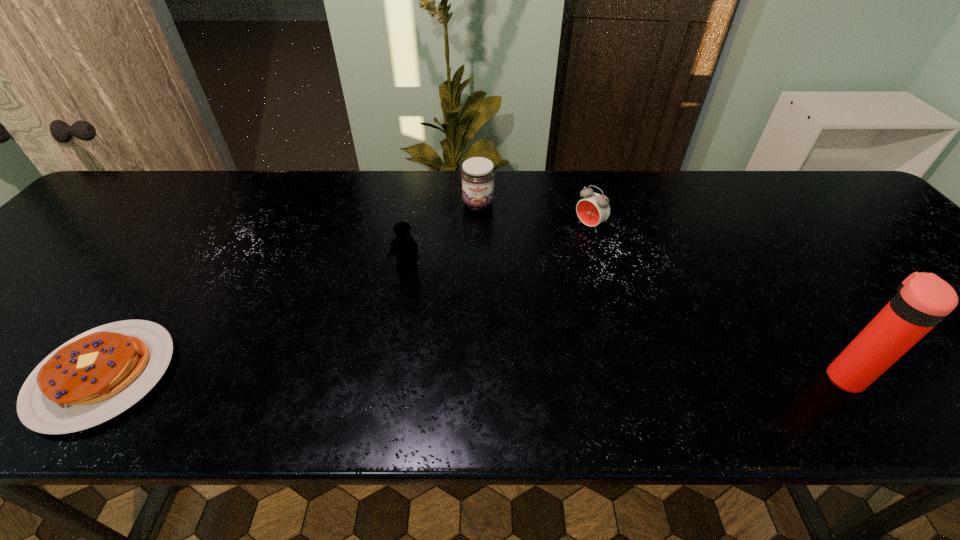
Find the location of a particular element. This screenshot has height=540, width=960. the tallest object is located at coordinates (923, 300).

The width and height of the screenshot is (960, 540). I want to click on thermos bottle, so click(923, 300).

Where is `the third farthest object`? the third farthest object is located at coordinates (405, 248).

This screenshot has width=960, height=540. What are the coordinates of `Lego` in the screenshot? It's located at (405, 248).

Where is `the farthest object`? The image size is (960, 540). the farthest object is located at coordinates (477, 175).

The image size is (960, 540). Identify the location of jam. click(477, 175).

This screenshot has height=540, width=960. I want to click on alarm clock, so click(593, 209).

The width and height of the screenshot is (960, 540). In order to click on the fourth nearest object in this screenshot , I will do `click(593, 209)`.

Locate an element on the screen. The height and width of the screenshot is (540, 960). vacant area situated 0.090m on the left of the thermos bottle is located at coordinates (780, 376).

Find the location of a particular element. vacant region located 0.120m on the front-facing side of the Lego is located at coordinates (393, 313).